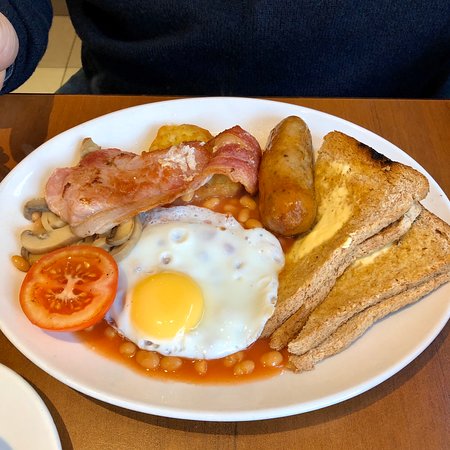
Locate an element on the screen. table is located at coordinates (219, 438).